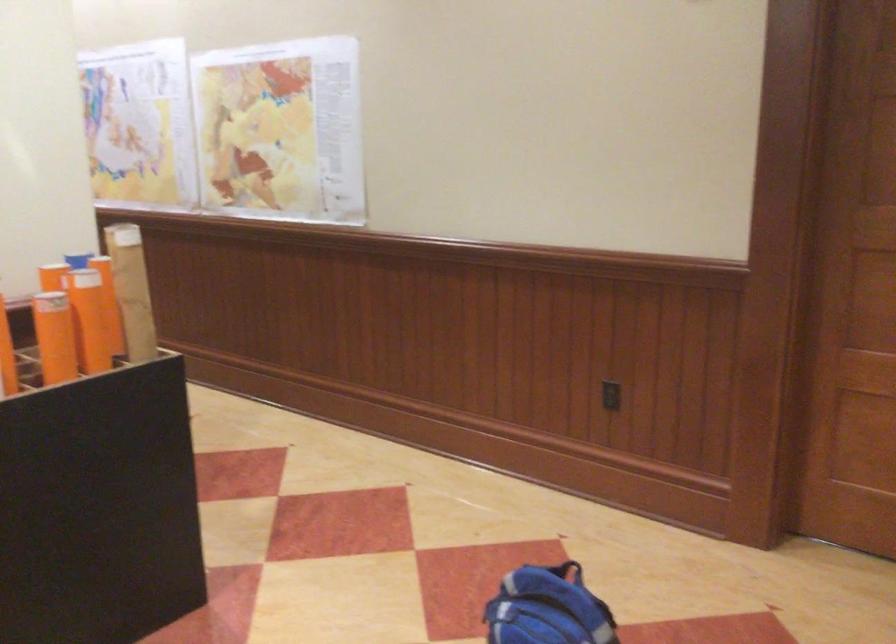
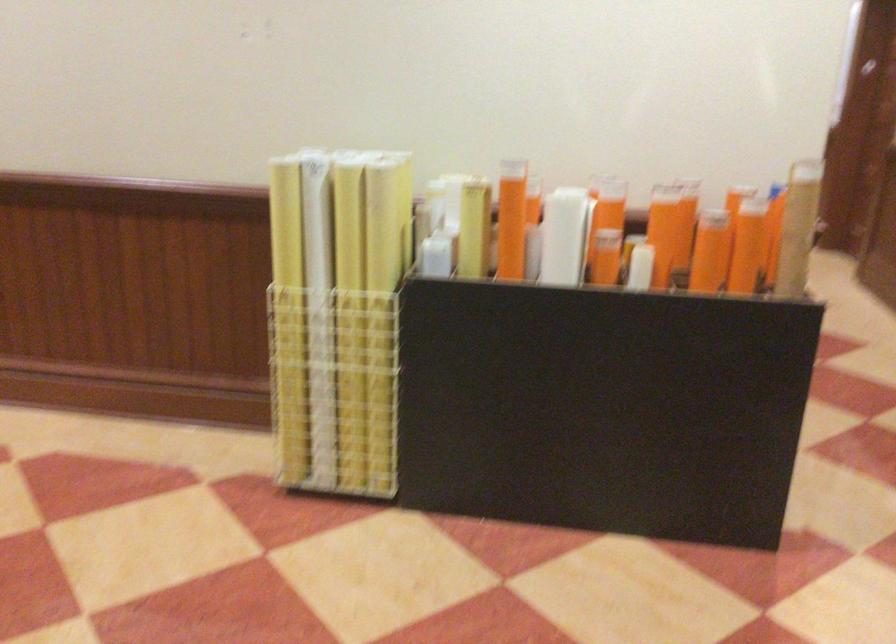
Where in the second image is the point corresponding to pixel 109 319 from the first image?

(746, 245)